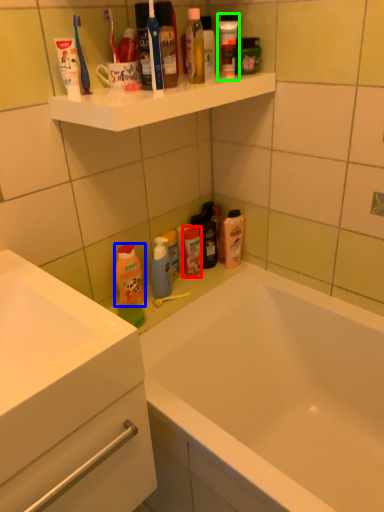
Question: Estimate the real-world distances between objects in this image. Which object is closer to toiletry (highlighted by a red box), cleaning product (highlighted by a blue box) or toiletry (highlighted by a green box)?

Choices:
 (A) cleaning product
 (B) toiletry

Answer: (A)